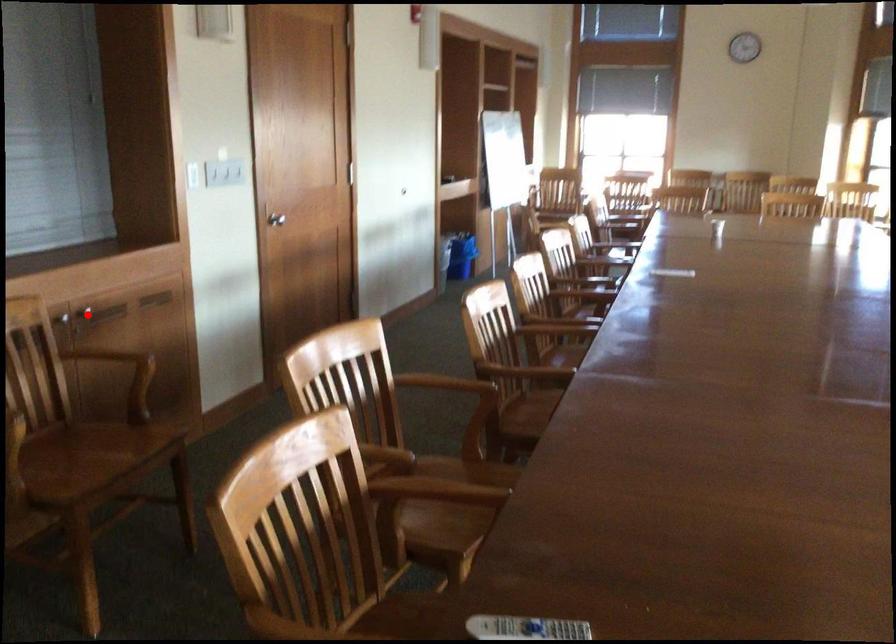
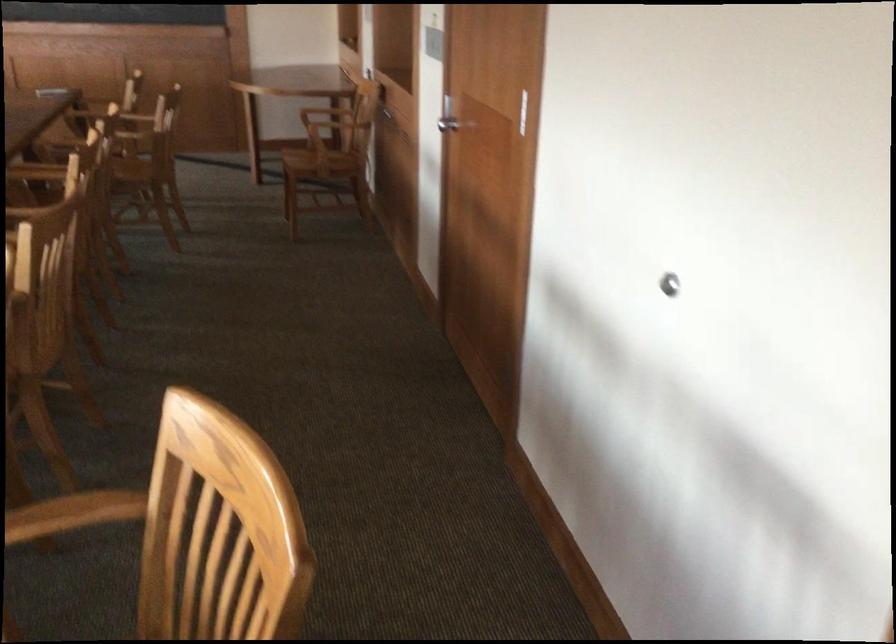
Question: I am providing you with two images of the same scene from different viewpoints. A red point is marked on the first image. Is the red point's position out of view in image 2?

Choices:
 (A) Yes
 (B) No

Answer: (A)